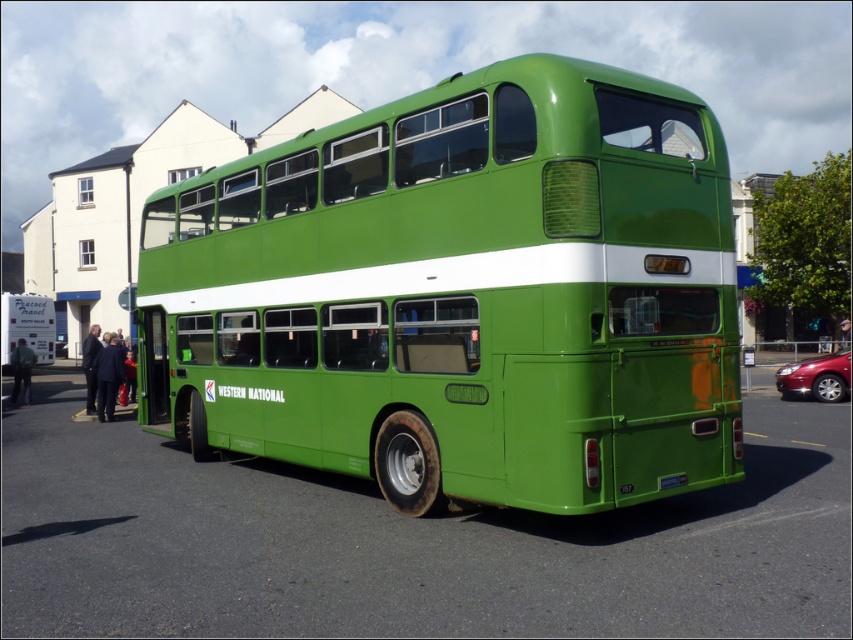
You are a delivery person who needs to place a new license plate on the rear of the green matte bus at center. The new license plate is exactly the same size as the existing green plastic license plate at rear. Will the new license plate fit without any modifications?

The green plastic license plate at rear is smaller than the green matte bus at center. Since the new license plate is the same size as the existing one, it will fit without any modifications.

You are a photographer trying to capture the green matte bus at center and the green plastic license plate at rear in a single shot. Based on their positions, will the license plate appear above or below the bus in your photo?

The green matte bus at center is below the green plastic license plate at rear, so the license plate will appear above the bus in the photo.